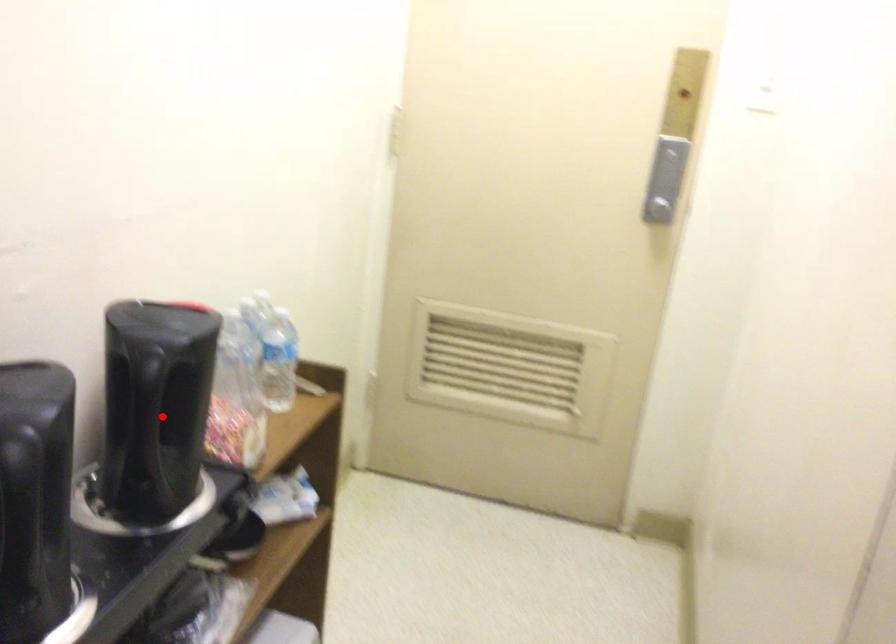
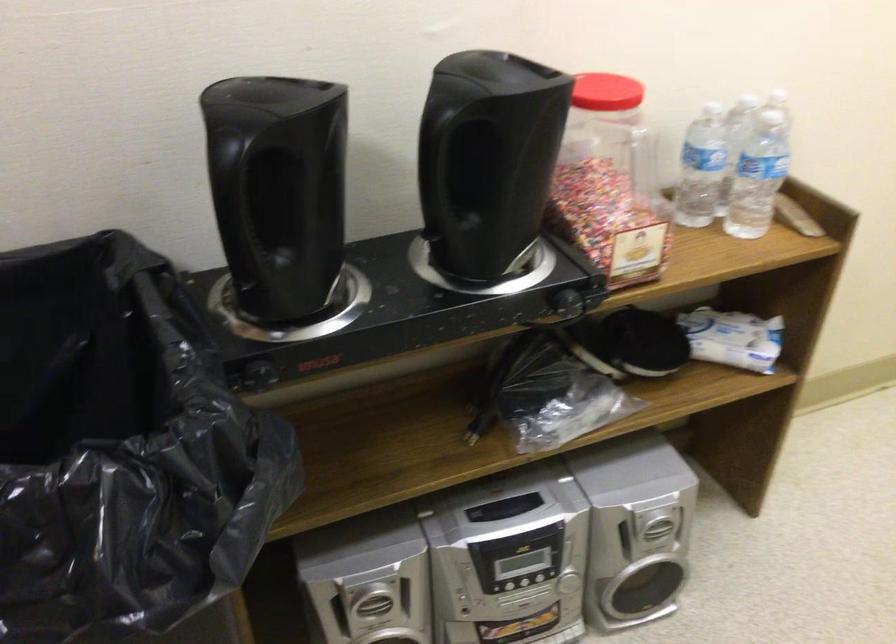
Question: I am providing you with two images of the same scene from different viewpoints. In image1, a red point is highlighted. Considering the same 3D point in image2, which of the following is correct?

Choices:
 (A) It is closer
 (B) It is farther

Answer: (A)